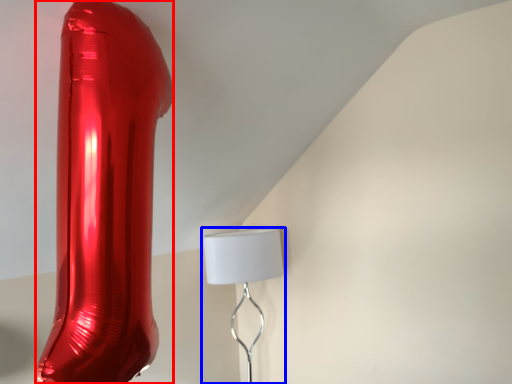
Question: Which object is further to the camera taking this photo, glass vase (highlighted by a red box) or lamp (highlighted by a blue box)?

Choices:
 (A) glass vase
 (B) lamp

Answer: (B)